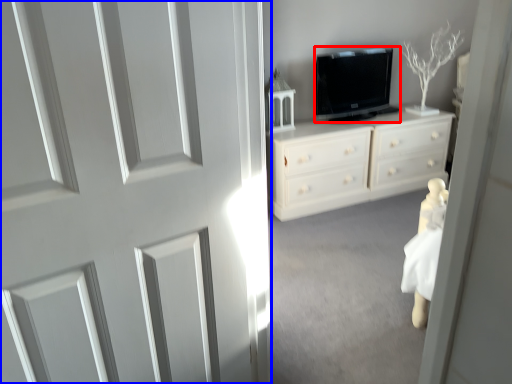
Question: Which object appears farthest to the camera in this image, television (highlighted by a red box) or door (highlighted by a blue box)?

Choices:
 (A) television
 (B) door

Answer: (A)